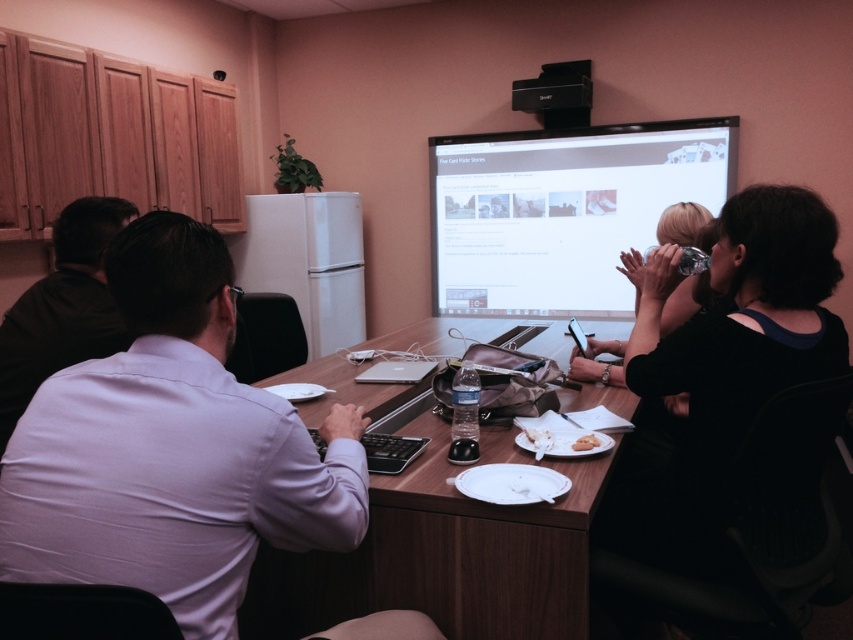
Does black matte shirt at right lie behind matte white screen at upper center?

No, it is in front of matte white screen at upper center.

Between point (828, 248) and point (685, 134), which one is positioned behind?

The point (685, 134) is behind.

Locate an element on the screen. This screenshot has height=640, width=853. black matte shirt at right is located at coordinates (727, 364).

Between black matte shirt at right and dark gray shirt at left, which one has more height?

Standing taller between the two is black matte shirt at right.

Is black matte shirt at right thinner than dark gray shirt at left?

In fact, black matte shirt at right might be wider than dark gray shirt at left.

This screenshot has height=640, width=853. I want to click on black matte shirt at right, so click(x=727, y=364).

Is dark gray shirt at left closer to the viewer compared to white matte bread at lower center?

No, it is behind white matte bread at lower center.

Between dark gray shirt at left and white matte bread at lower center, which one has less height?

With less height is white matte bread at lower center.

Does point (91, 266) come farther from viewer compared to point (579, 444)?

Yes, it is behind point (579, 444).

Locate an element on the screen. dark gray shirt at left is located at coordinates (62, 307).